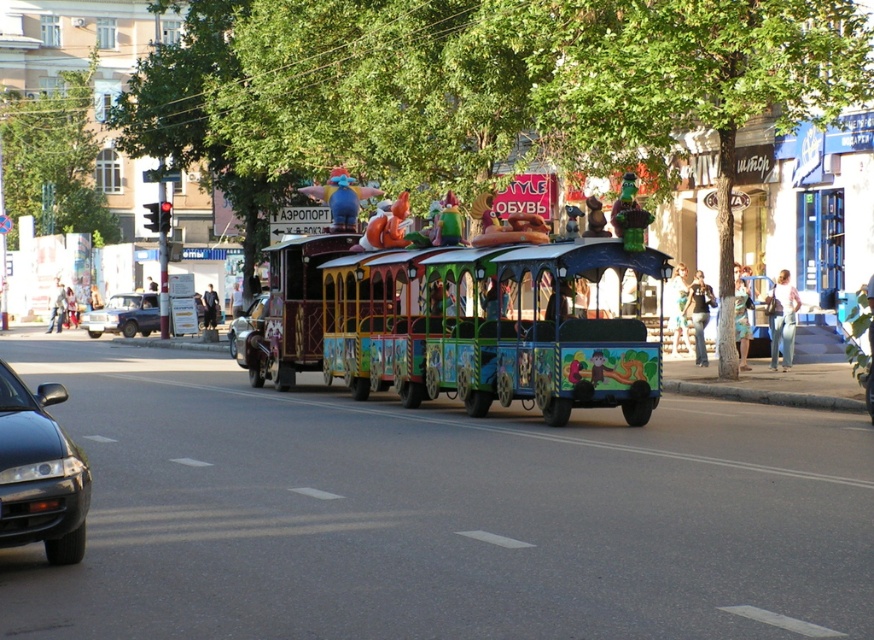
Can you confirm if light blue jeans at lower left is positioned below dark blue suit at center?

Actually, light blue jeans at lower left is above dark blue suit at center.

What do you see at coordinates (57, 307) in the screenshot?
I see `light blue jeans at lower left` at bounding box center [57, 307].

Where is `light blue jeans at lower left`? light blue jeans at lower left is located at coordinates (57, 307).

Who is lower down, denim skirt at right or light blue jeans at lower left?

denim skirt at right is below.

Does denim skirt at right have a lesser height compared to light blue jeans at lower left?

Indeed, denim skirt at right has a lesser height compared to light blue jeans at lower left.

This screenshot has height=640, width=874. I want to click on denim skirt at right, so click(x=741, y=317).

Where is `denim skirt at right`? denim skirt at right is located at coordinates (741, 317).

Which of these two, shiny silver car at center or dark blue suit at center, stands shorter?

With less height is dark blue suit at center.

Does shiny silver car at center have a greater width compared to dark blue suit at center?

Indeed, shiny silver car at center has a greater width compared to dark blue suit at center.

Is point (230, 355) positioned before point (212, 326)?

Yes.

Image resolution: width=874 pixels, height=640 pixels. Identify the location of shiny silver car at center. (246, 326).